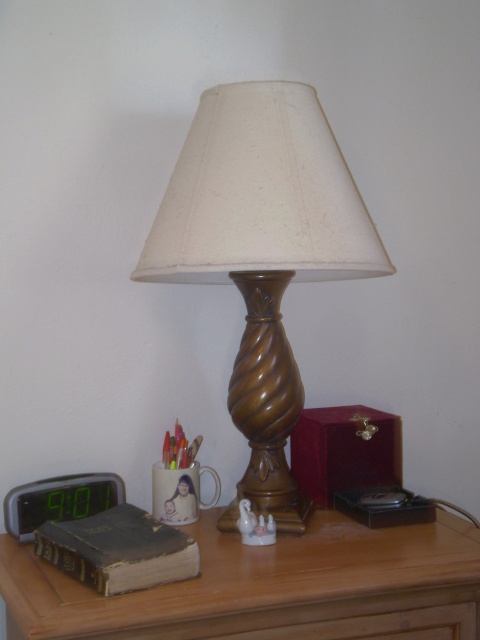
Can you confirm if wooden table lamp at center is positioned to the right of brown wooden table at center?

Correct, you'll find wooden table lamp at center to the right of brown wooden table at center.

In the scene shown: Does wooden table lamp at center have a lesser height compared to brown wooden table at center?

No, wooden table lamp at center is not shorter than brown wooden table at center.

Is point (334, 259) farther from viewer compared to point (392, 545)?

No.

The image size is (480, 640). I want to click on wooden table lamp at center, so click(262, 252).

Can you confirm if brown leather book at lower left is positioned above green digital display at left?

No.

Which of these two, brown leather book at lower left or green digital display at left, stands shorter?

brown leather book at lower left

This screenshot has height=640, width=480. Describe the element at coordinates (118, 548) in the screenshot. I see `brown leather book at lower left` at that location.

Where is `brown leather book at lower left`? The image size is (480, 640). brown leather book at lower left is located at coordinates (118, 548).

Is brown wooden table at center taller than green digital display at left?

Correct, brown wooden table at center is much taller as green digital display at left.

Where is `brown wooden table at center`? This screenshot has width=480, height=640. brown wooden table at center is located at coordinates (269, 586).